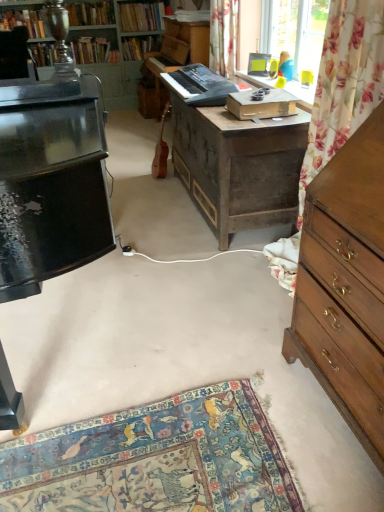
Find the location of `free space to the right of black glossy piano at left, the first piano when ordered from front to back`. free space to the right of black glossy piano at left, the first piano when ordered from front to back is located at coordinates (204, 312).